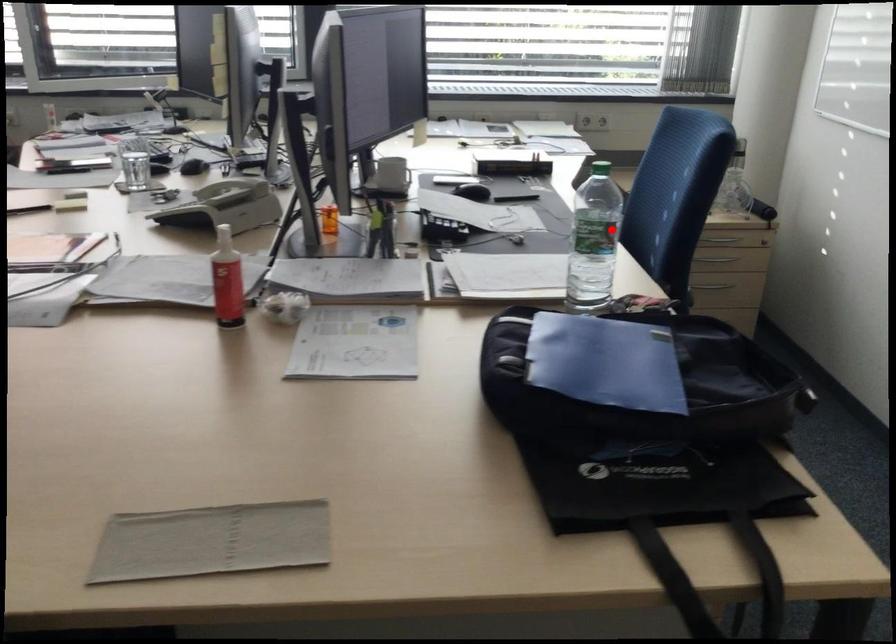
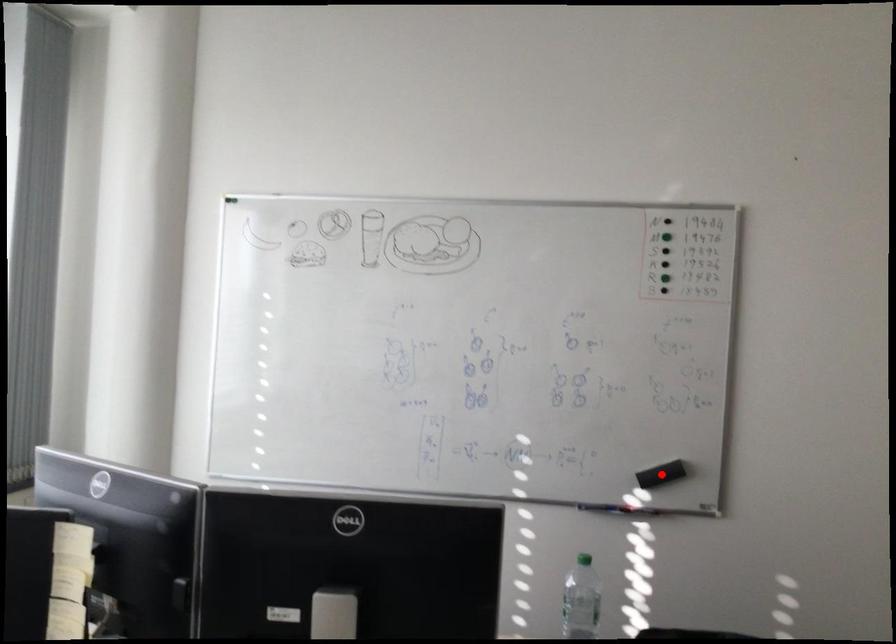
Looking at this image, I am providing you with two images of the same scene from different viewpoints. A red point is marked on the first image and another point is marked on the second image. Is the marked point in image1 the same physical position as the marked point in image2?

No